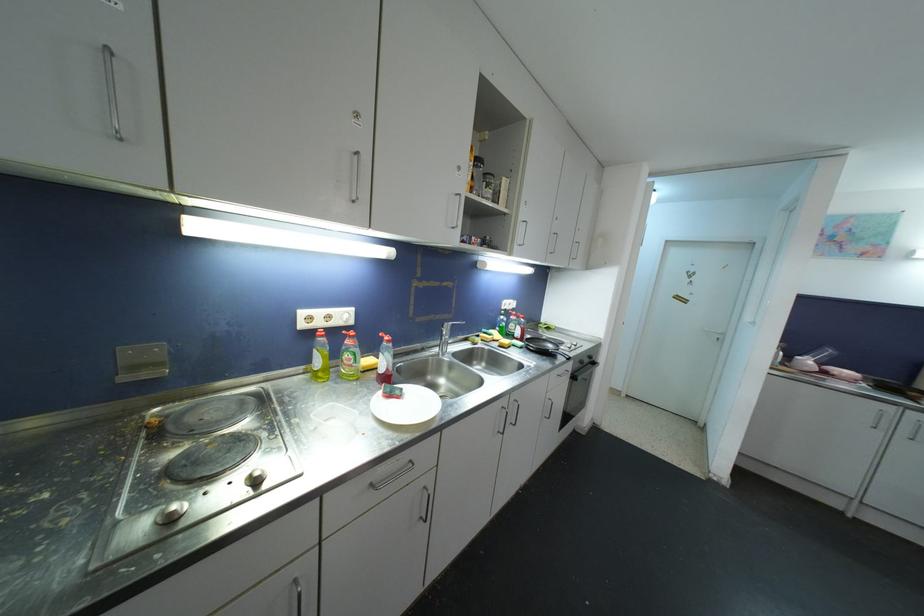
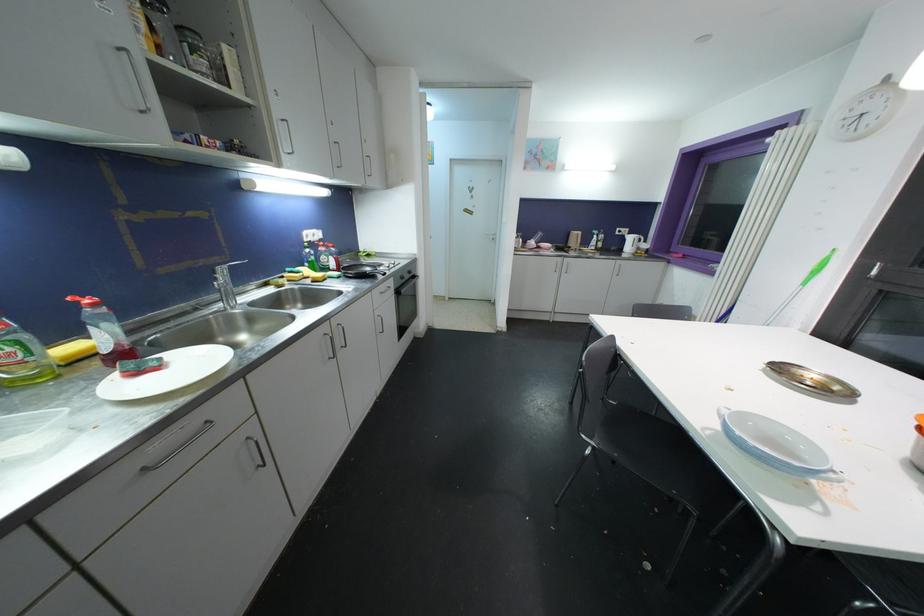
The point at (360, 353) is marked in the first image. Where is the corresponding point in the second image?

(27, 339)